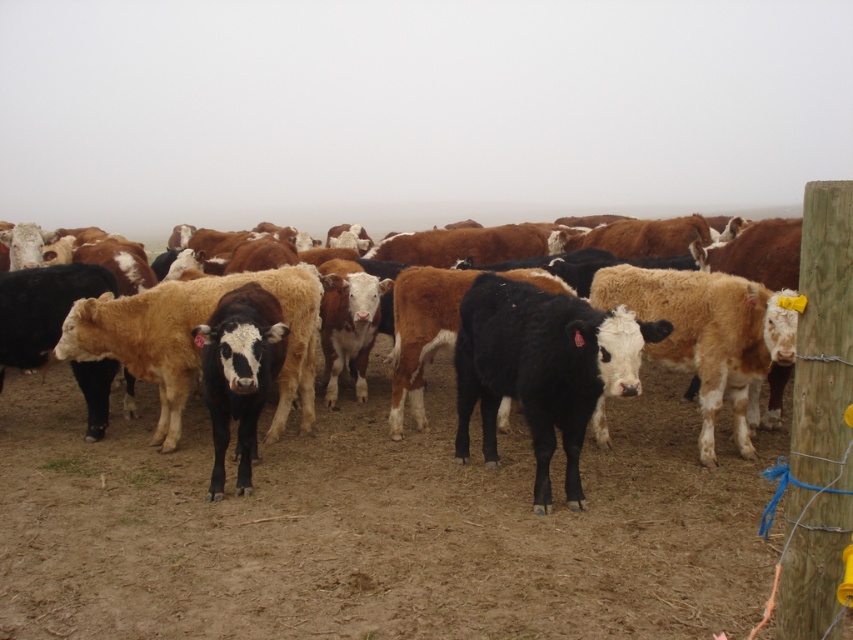
You are standing in the pasture and want to walk from the wooden post to the group of cattle. Which point, point (341, 433) or point (241, 348), is closer to you as you start your journey?

Point (341, 433) is closer to you because it is further to the viewer than point (241, 348), meaning it is nearer in your line of sight when starting from the wooden post.